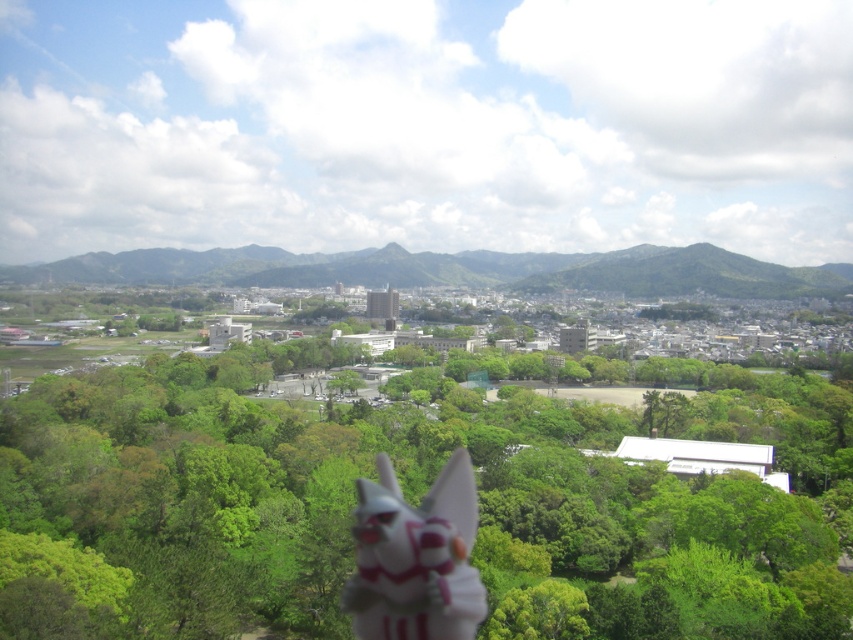
Who is more distant from viewer, (107, 627) or (473, 506)?

The point (473, 506) is behind.

Is green leafy tree at center shorter than white glossy fox at lower center?

No.

Is point (648, 548) positioned before point (445, 589)?

No, it is behind (445, 589).

The image size is (853, 640). I want to click on green leafy tree at center, so click(x=409, y=502).